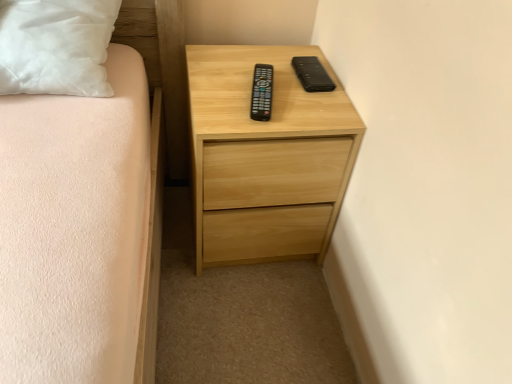
Where is `vacant area in front of black plastic remote at center`? This screenshot has height=384, width=512. vacant area in front of black plastic remote at center is located at coordinates (251, 127).